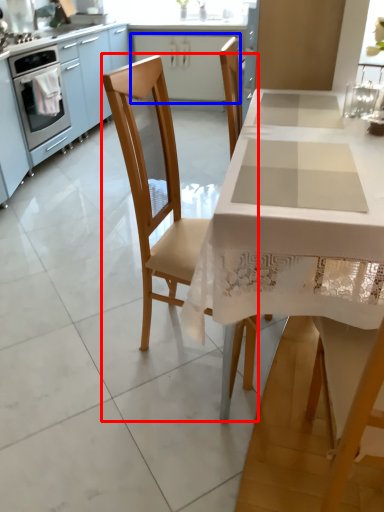
Question: Among these objects, which one is farthest to the camera, chair (highlighted by a red box) or cabinetry (highlighted by a blue box)?

Choices:
 (A) chair
 (B) cabinetry

Answer: (B)